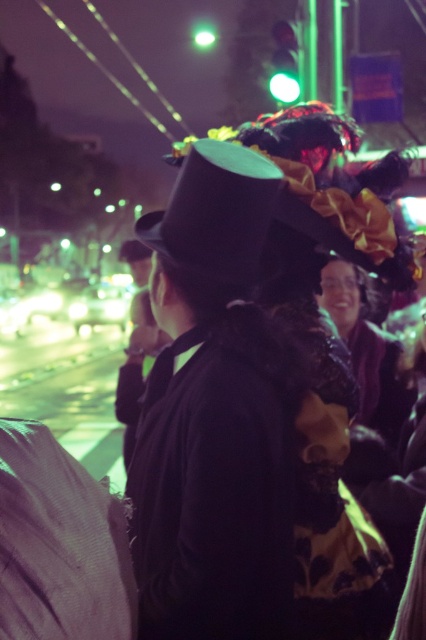
Is matte black hat at center thinner than sparkly purple dress at center?

No, matte black hat at center is not thinner than sparkly purple dress at center.

Does matte black hat at center come behind sparkly purple dress at center?

No, matte black hat at center is closer to the viewer.

Is point (204, 403) behind point (383, 381)?

That is False.

Locate an element on the screen. This screenshot has height=640, width=426. matte black hat at center is located at coordinates (213, 416).

In the scene shown: Does sparkly purple dress at center have a lesser height compared to matte black jacket at center?

Incorrect, sparkly purple dress at center's height does not fall short of matte black jacket at center's.

Is sparkly purple dress at center bigger than matte black jacket at center?

Yes, sparkly purple dress at center is bigger than matte black jacket at center.

Who is more distant from viewer, [365,388] or [117,408]?

Positioned behind is point [117,408].

Locate an element on the screen. sparkly purple dress at center is located at coordinates (368, 349).

Which is more to the left, matte black hat at center or matte black jacket at center?

matte black jacket at center is more to the left.

Between matte black hat at center and matte black jacket at center, which one is positioned lower?

Positioned lower is matte black hat at center.

Which is behind, point (253, 593) or point (138, 378)?

Positioned behind is point (138, 378).

Where is `matte black hat at center`? The image size is (426, 640). matte black hat at center is located at coordinates (213, 416).